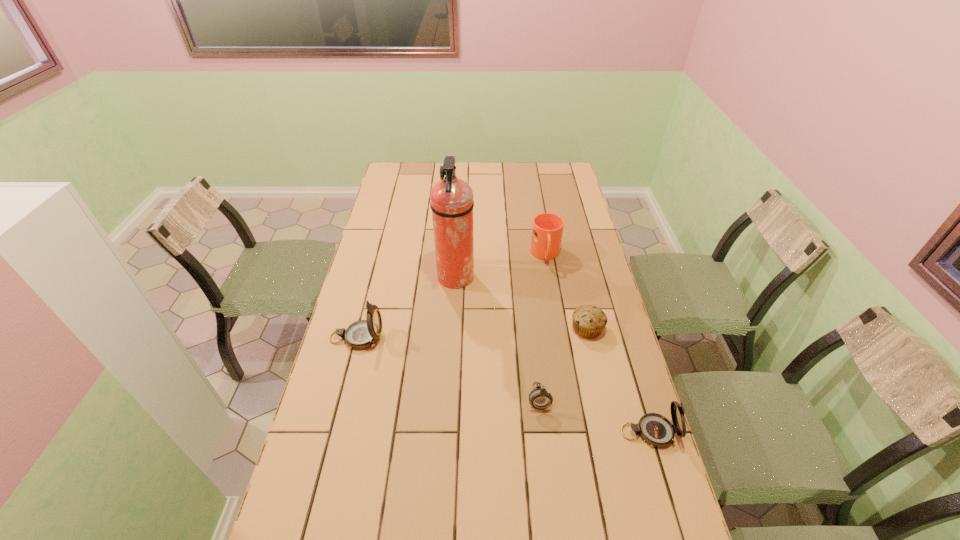
Where is `vacant position for inserting another compass evenly`? This screenshot has height=540, width=960. vacant position for inserting another compass evenly is located at coordinates (443, 365).